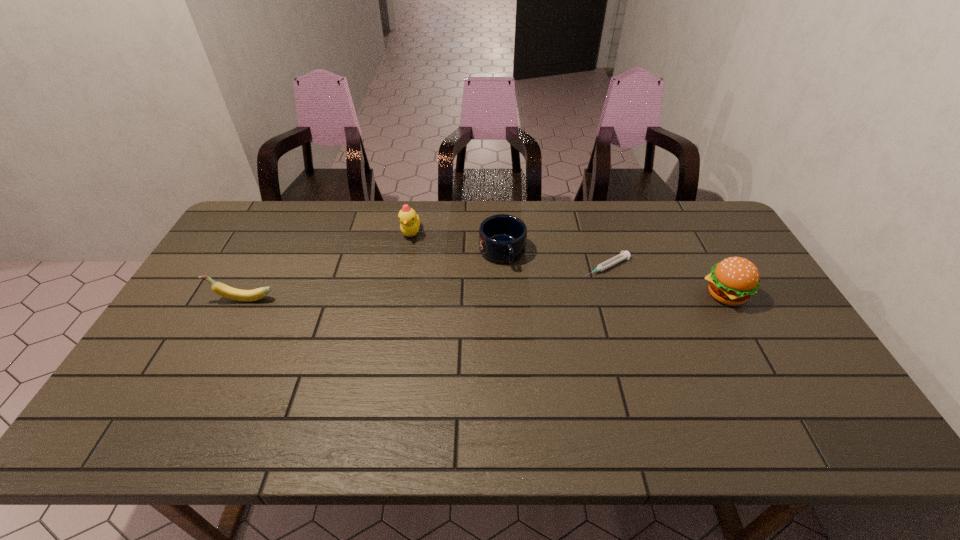
What are the coordinates of `free location that satisfies the following two spatial constraints: 1. on the front side of the fourth object from right to left; 2. on the left side of the hamburger` in the screenshot? It's located at coord(400,295).